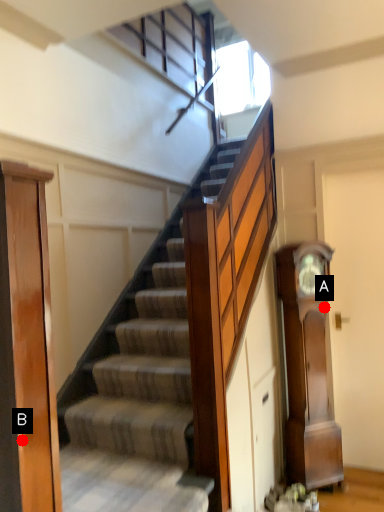
Question: Two points are circled on the image, labeled by A and B beside each circle. Among these points, which one is farthest from the camera?

Choices:
 (A) A is further
 (B) B is further

Answer: (A)